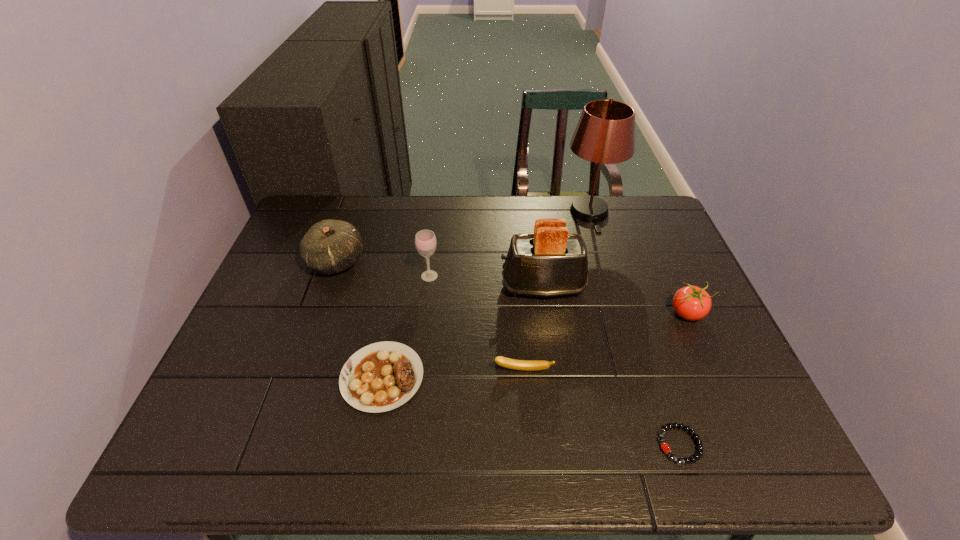
You are a GUI agent. You are given a task and a screenshot of the screen. Output one action in this format:
    pyautogui.click(x=<x>, y=<y>)
    Task: Click on the free space located 0.330m on the back of the shortest object
    
    Given the screenshot: What is the action you would take?
    pyautogui.click(x=634, y=307)

Where is `object that is at the far edge`? object that is at the far edge is located at coordinates (605, 133).

This screenshot has height=540, width=960. In order to click on object at the near edge in this screenshot , I will do `click(665, 447)`.

Where is `object located at the left edge`? Image resolution: width=960 pixels, height=540 pixels. object located at the left edge is located at coordinates (330, 246).

Where is `lampshade present at the right edge`? This screenshot has height=540, width=960. lampshade present at the right edge is located at coordinates (605, 133).

You are a GUI agent. You are given a task and a screenshot of the screen. Output one action in this format:
    pyautogui.click(x=<x>, y=<y>)
    Task: Click on the tomato situated at the right edge
    Image resolution: width=960 pixels, height=540 pixels.
    Given the screenshot: What is the action you would take?
    pyautogui.click(x=692, y=303)

Identify the location of bracelet present at the right edge. The image size is (960, 540). (665, 447).

You are a GUI agent. You are given a task and a screenshot of the screen. Output one action in this format:
    pyautogui.click(x=<x>, y=<y>)
    Task: Click on the object that is positioned at the far right corner
    This screenshot has width=960, height=540.
    Given the screenshot: What is the action you would take?
    pyautogui.click(x=605, y=133)

The height and width of the screenshot is (540, 960). I want to click on object that is at the near right corner, so click(665, 447).

I want to click on blank space at the far edge of the desktop, so click(x=520, y=218).